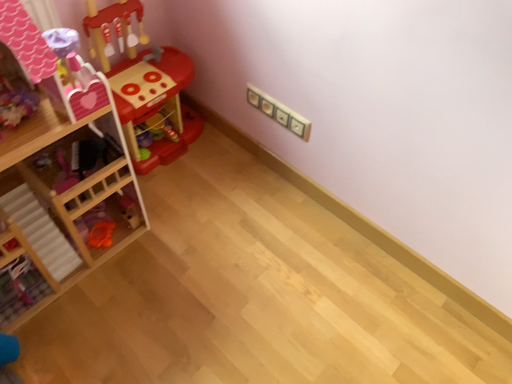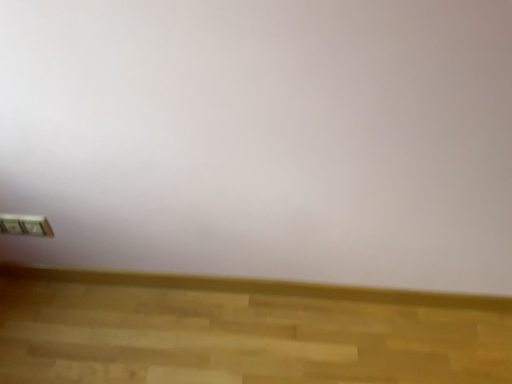
Question: Which way did the camera rotate in the video?

Choices:
 (A) rotated right
 (B) rotated left

Answer: (A)